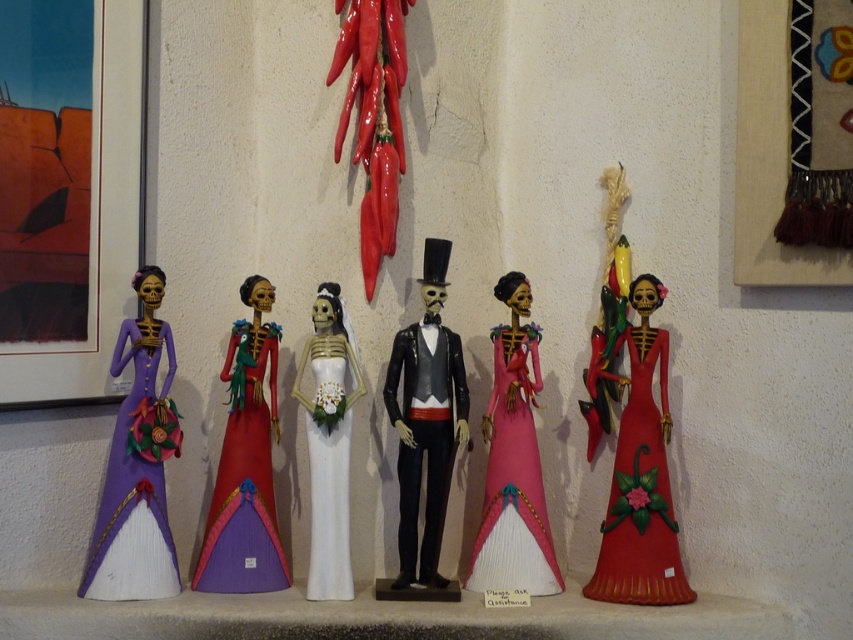
Question: Which object appears farthest from the camera in this image?

Choices:
 (A) matte painted wooden skeleton at center
 (B) matte purple paper doll at left

Answer: (A)

Question: Which point is farther to the camera?

Choices:
 (A) (531, 541)
 (B) (403, 376)

Answer: (B)

Question: Does matte purple paper doll at left appear under white matte wedding dress at center?

Choices:
 (A) yes
 (B) no

Answer: (B)

Question: Is matte purple paper doll at left to the right of white matte wedding dress at center from the viewer's perspective?

Choices:
 (A) no
 (B) yes

Answer: (A)

Question: Can you confirm if pink papier-mâché doll at center is positioned to the left of white matte wedding dress at center?

Choices:
 (A) no
 (B) yes

Answer: (A)

Question: Which object appears closest to the camera in this image?

Choices:
 (A) matte purple paper doll at left
 (B) white matte wedding dress at center

Answer: (A)